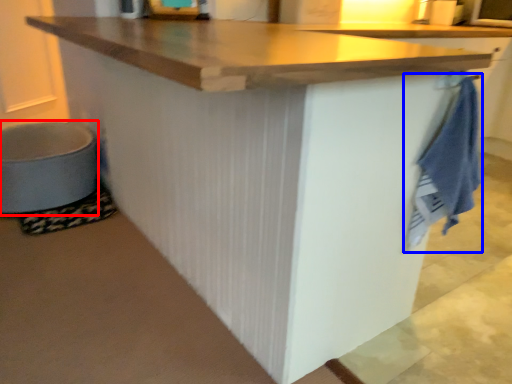
Question: Which object is closer to the camera taking this photo, step stool (highlighted by a red box) or bath towel (highlighted by a blue box)?

Choices:
 (A) step stool
 (B) bath towel

Answer: (B)